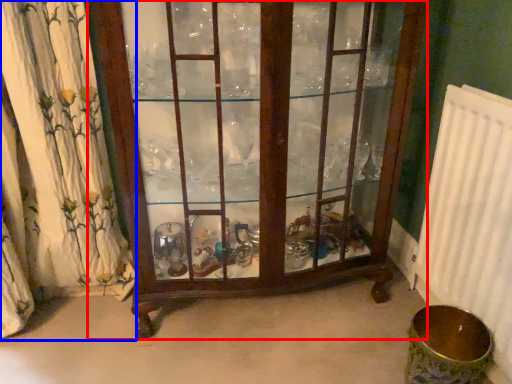
Question: Among these objects, which one is nearest to the camera, furniture (highlighted by a red box) or curtain (highlighted by a blue box)?

Choices:
 (A) furniture
 (B) curtain

Answer: (A)